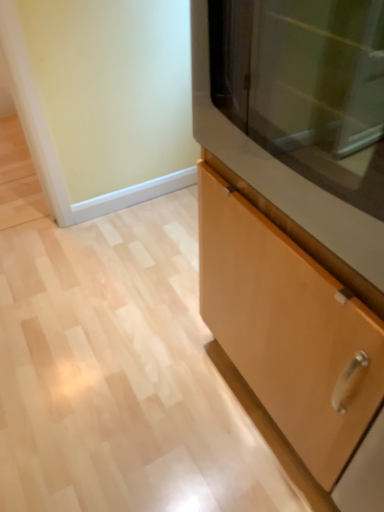
Question: From a real-world perspective, is matte brown cabinet at right positioned under light wood cabinet at center based on gravity?

Choices:
 (A) yes
 (B) no

Answer: (B)

Question: Does matte brown cabinet at right turn towards light wood cabinet at center?

Choices:
 (A) no
 (B) yes

Answer: (B)

Question: Is matte brown cabinet at right shorter than light wood cabinet at center?

Choices:
 (A) no
 (B) yes

Answer: (B)

Question: From a real-world perspective, is matte brown cabinet at right positioned over light wood cabinet at center based on gravity?

Choices:
 (A) yes
 (B) no

Answer: (A)

Question: Can light wood cabinet at center be found inside matte brown cabinet at right?

Choices:
 (A) yes
 (B) no

Answer: (B)

Question: Does matte brown cabinet at right have a smaller size compared to light wood cabinet at center?

Choices:
 (A) yes
 (B) no

Answer: (A)

Question: Does light wood cabinet at center have a smaller size compared to matte brown cabinet at right?

Choices:
 (A) yes
 (B) no

Answer: (B)

Question: Is light wood cabinet at center positioned behind matte brown cabinet at right?

Choices:
 (A) no
 (B) yes

Answer: (A)

Question: Can you confirm if light wood cabinet at center is thinner than matte brown cabinet at right?

Choices:
 (A) yes
 (B) no

Answer: (A)

Question: Does light wood cabinet at center have a larger size compared to matte brown cabinet at right?

Choices:
 (A) no
 (B) yes

Answer: (B)

Question: Is light wood cabinet at center at the left side of matte brown cabinet at right?

Choices:
 (A) yes
 (B) no

Answer: (B)

Question: Is light wood cabinet at center touching matte brown cabinet at right?

Choices:
 (A) no
 (B) yes

Answer: (A)

Question: Looking at their shapes, would you say light wood cabinet at center is wider or thinner than matte brown cabinet at right?

Choices:
 (A) wide
 (B) thin

Answer: (B)